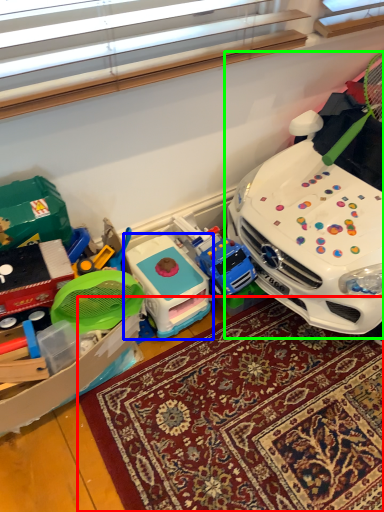
Question: Which is nearer to the mat (highlighted by a red box)? toy (highlighted by a blue box) or toy (highlighted by a green box).

Choices:
 (A) toy
 (B) toy

Answer: (A)